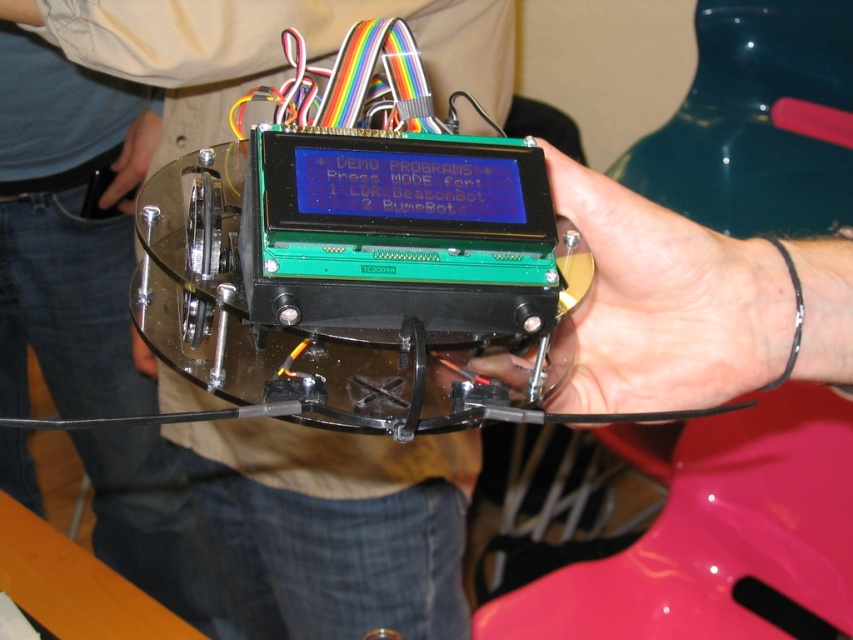
Question: Which object appears farthest from the camera in this image?

Choices:
 (A) matte black laptop at center
 (B) green matte lcd screen at center

Answer: (A)

Question: Which object is closer to the camera taking this photo?

Choices:
 (A) green matte lcd screen at center
 (B) matte black laptop at center

Answer: (A)

Question: Among these points, which one is nearest to the camera?

Choices:
 (A) (550, 150)
 (B) (265, 500)

Answer: (A)

Question: Does matte black laptop at center have a lesser width compared to green matte lcd screen at center?

Choices:
 (A) yes
 (B) no

Answer: (B)

Question: Does matte black laptop at center come behind green matte lcd screen at center?

Choices:
 (A) no
 (B) yes

Answer: (B)

Question: Can you confirm if matte black laptop at center is thinner than green matte lcd screen at center?

Choices:
 (A) yes
 (B) no

Answer: (B)